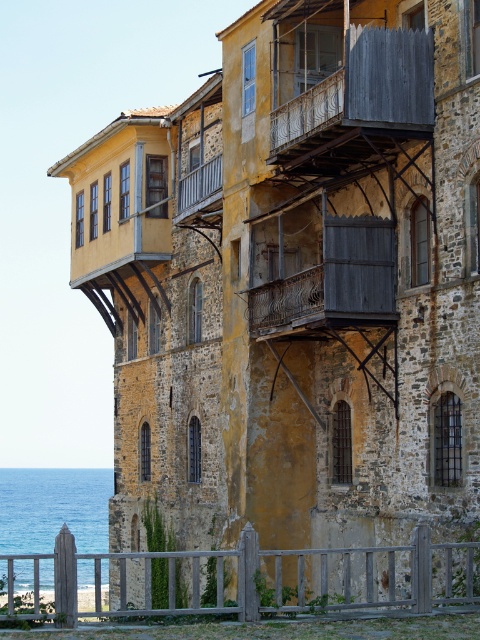
You are standing in front of the weathered stone building and want to take a photo. You notice two points marked on the building. The first point is at coordinate point [434,545] and the second is at point [350,68]. Which point will appear larger in your photo?

Point [434,545] is closer to the camera than point [350,68], so it will appear larger in the photo.

You are a painter who needs to decide which area to paint first. Given the wooden fence at lower center and the wooden slats at upper right, which one has a wider structure?

The wooden fence at lower center has a wider structure than the wooden slats at upper right, as its width surpasses the latter.

You are standing in front of the stone building and want to walk towards the blue water at lower left. Which direction should you move relative to the wooden fence at lower center?

The wooden fence at lower center is positioned on the right side of blue water at lower left. To reach the blue water at lower left, you should move to the left of the wooden fence at lower center.